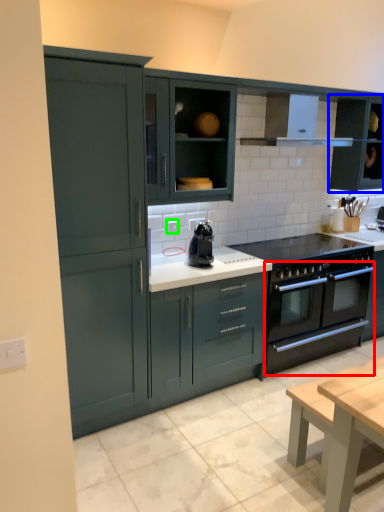
Question: Which is farther away from oven (highlighted by a red box)? cabinetry (highlighted by a blue box) or electric outlet (highlighted by a green box)?

Choices:
 (A) cabinetry
 (B) electric outlet

Answer: (B)